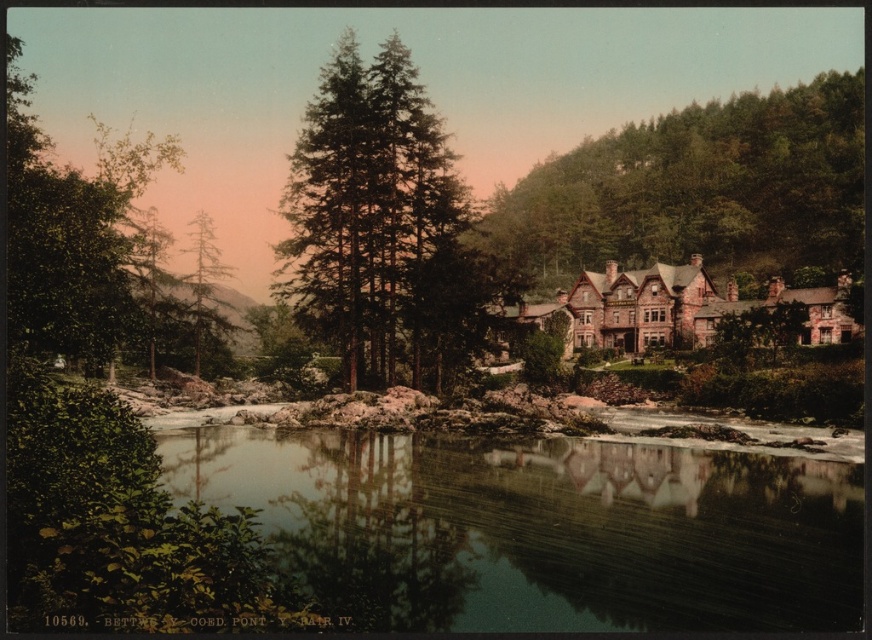
Question: Is green leafy tree at upper right further to camera compared to green textured tree at center?

Choices:
 (A) no
 (B) yes

Answer: (B)

Question: Which point appears farthest from the camera in this image?

Choices:
 (A) tap(528, 236)
 (B) tap(467, 518)

Answer: (A)

Question: Does green leafy tree at upper right lie in front of green textured tree at center?

Choices:
 (A) yes
 (B) no

Answer: (B)

Question: Considering the relative positions of clear glass water at center and green leafy tree at upper right in the image provided, where is clear glass water at center located with respect to green leafy tree at upper right?

Choices:
 (A) right
 (B) left

Answer: (B)

Question: Which point appears closest to the camera in this image?

Choices:
 (A) (318, 262)
 (B) (716, 179)
 (C) (508, 573)

Answer: (C)

Question: Which object is closer to the camera taking this photo?

Choices:
 (A) green leafy tree at upper right
 (B) green matte tree at upper left

Answer: (A)